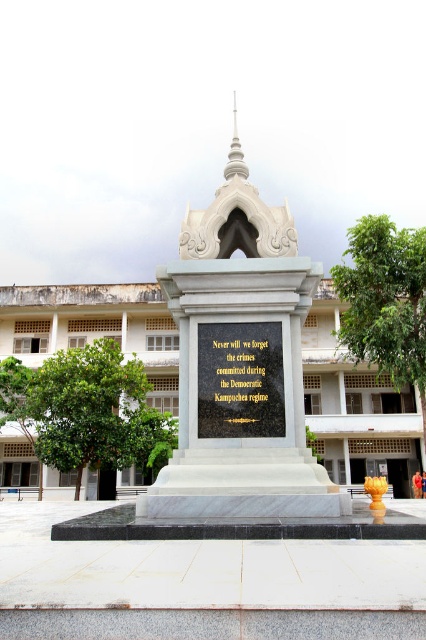
Question: Does white marble monument at center have a greater width compared to goldmaterial/textureplaque at center?

Choices:
 (A) yes
 (B) no

Answer: (A)

Question: Which of the following is the farthest from the observer?

Choices:
 (A) white marble monument at center
 (B) goldmaterial/textureplaque at center

Answer: (B)

Question: In this image, where is white marble monument at center located relative to goldmaterial/textureplaque at center?

Choices:
 (A) right
 (B) left

Answer: (B)

Question: Which object is farther from the camera taking this photo?

Choices:
 (A) white marble monument at center
 (B) goldmaterial/textureplaque at center

Answer: (B)

Question: Is white marble monument at center smaller than goldmaterial/textureplaque at center?

Choices:
 (A) no
 (B) yes

Answer: (A)